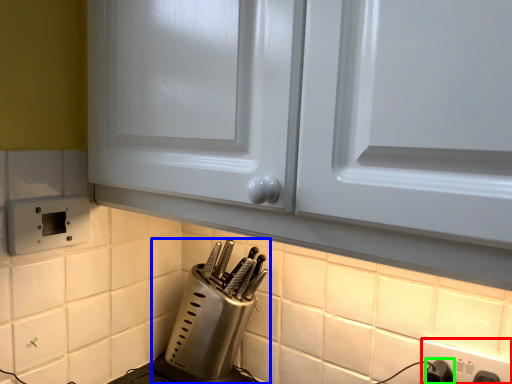
Question: Which object is the closest to the electric outlet (highlighted by a red box)? Choose among these: kitchen appliance (highlighted by a blue box) or switch (highlighted by a green box).

Choices:
 (A) kitchen appliance
 (B) switch

Answer: (B)